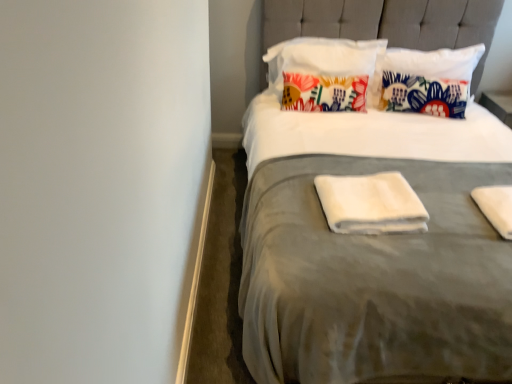
Question: Is white soft towel at right, the 2th material in the left-to-right sequence, turned away from suede gray bed at center?

Choices:
 (A) no
 (B) yes

Answer: (B)

Question: Is white soft towel at right, the 2th material in the left-to-right sequence, shorter than suede gray bed at center?

Choices:
 (A) yes
 (B) no

Answer: (A)

Question: Would you say white soft towel at right, the 1th material positioned from the right, is outside suede gray bed at center?

Choices:
 (A) no
 (B) yes

Answer: (A)

Question: Is suede gray bed at center inside white soft towel at right, the 2th material in the left-to-right sequence?

Choices:
 (A) yes
 (B) no

Answer: (B)

Question: Considering the relative sizes of white soft towel at right, the 2th material in the left-to-right sequence, and suede gray bed at center in the image provided, is white soft towel at right, the 2th material in the left-to-right sequence, thinner than suede gray bed at center?

Choices:
 (A) no
 (B) yes

Answer: (B)

Question: Considering the positions of white soft towel at center, arranged as the second material when viewed from the right, and floral fabric pillow at upper center, marked as the 2th pillow in a right-to-left arrangement, in the image, is white soft towel at center, arranged as the second material when viewed from the right, bigger or smaller than floral fabric pillow at upper center, marked as the 2th pillow in a right-to-left arrangement,?

Choices:
 (A) small
 (B) big

Answer: (A)

Question: Is white soft towel at center, arranged as the second material when viewed from the right, to the left or to the right of floral fabric pillow at upper center, marked as the 1th pillow in a left-to-right arrangement, in the image?

Choices:
 (A) left
 (B) right

Answer: (B)

Question: From the image's perspective, relative to floral fabric pillow at upper center, marked as the 1th pillow in a left-to-right arrangement, is white soft towel at center, arranged as the second material when viewed from the right, above or below?

Choices:
 (A) below
 (B) above

Answer: (A)

Question: Is point (343, 215) positioned closer to the camera than point (353, 79)?

Choices:
 (A) farther
 (B) closer

Answer: (B)

Question: Does point (271, 59) appear closer or farther from the camera than point (453, 82)?

Choices:
 (A) closer
 (B) farther

Answer: (B)

Question: From a real-world perspective, is floral fabric pillow at upper center, marked as the 2th pillow in a right-to-left arrangement, positioned above or below floral fabric pillow at upper center, which ranks as the 1th pillow in right-to-left order?

Choices:
 (A) below
 (B) above

Answer: (B)

Question: Relative to floral fabric pillow at upper center, acting as the 2th pillow starting from the left, is floral fabric pillow at upper center, marked as the 2th pillow in a right-to-left arrangement, in front or behind?

Choices:
 (A) behind
 (B) front

Answer: (B)

Question: Would you say floral fabric pillow at upper center, marked as the 1th pillow in a left-to-right arrangement, is to the left or to the right of floral fabric pillow at upper center, which ranks as the 1th pillow in right-to-left order, in the picture?

Choices:
 (A) left
 (B) right

Answer: (A)

Question: From the image's perspective, relative to floral fabric pillow at upper center, marked as the 1th pillow in a left-to-right arrangement, is floral fabric pillow at upper center, which ranks as the 1th pillow in right-to-left order, above or below?

Choices:
 (A) below
 (B) above

Answer: (A)

Question: Is floral fabric pillow at upper center, acting as the 2th pillow starting from the left, wider or thinner than floral fabric pillow at upper center, marked as the 1th pillow in a left-to-right arrangement?

Choices:
 (A) thin
 (B) wide

Answer: (B)